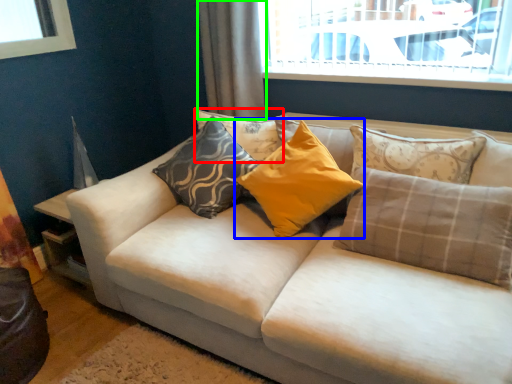
Question: Which is farther away from pillow (highlighted by a red box)? pillow (highlighted by a blue box) or curtain (highlighted by a green box)?

Choices:
 (A) pillow
 (B) curtain

Answer: (B)